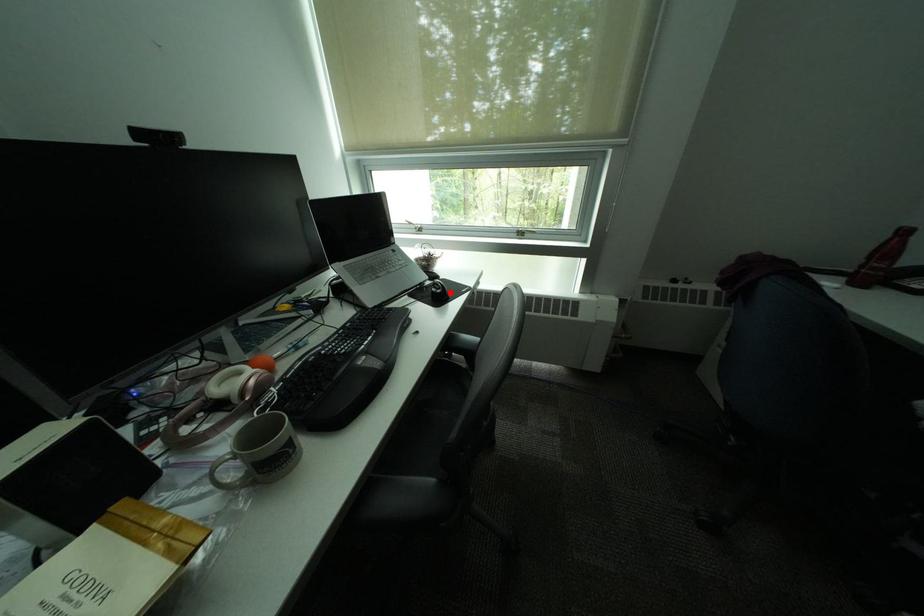
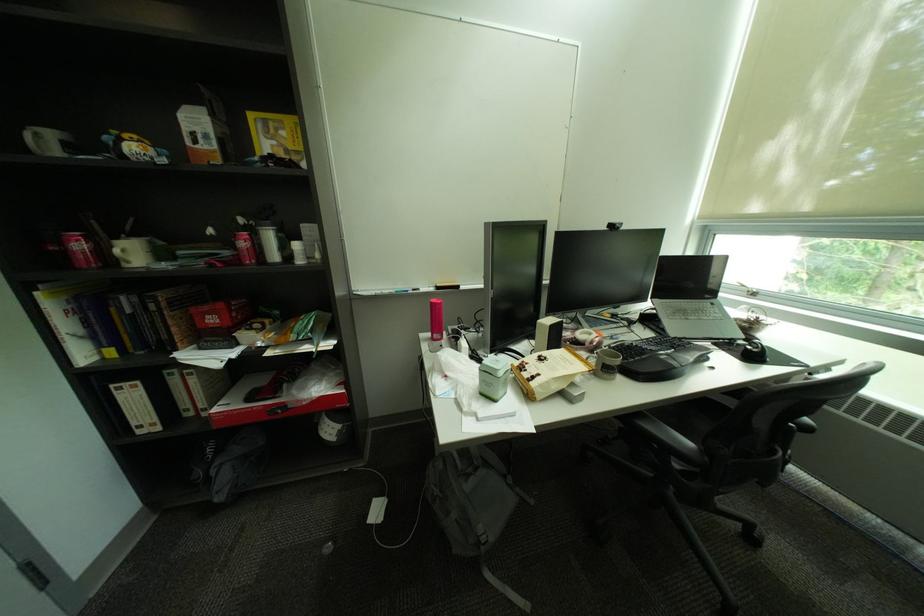
Where in the second image is the point corresponding to the highlighted location from the first image?

(766, 352)